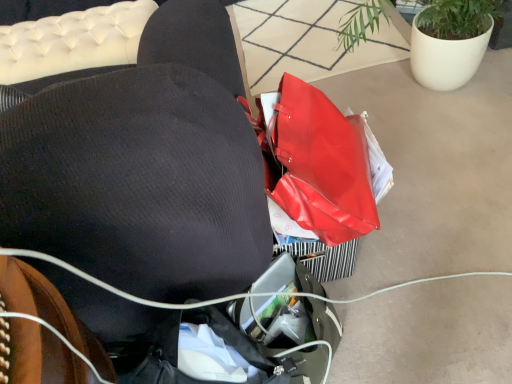
Question: Considering the positions of black fabric bean bag chair at center and matte white pot at upper right in the image, is black fabric bean bag chair at center wider or thinner than matte white pot at upper right?

Choices:
 (A) wide
 (B) thin

Answer: (A)

Question: From a real-world perspective, is black fabric bean bag chair at center above or below matte white pot at upper right?

Choices:
 (A) above
 (B) below

Answer: (A)

Question: In terms of size, does black fabric bean bag chair at center appear bigger or smaller than matte white pot at upper right?

Choices:
 (A) big
 (B) small

Answer: (A)

Question: Relative to black fabric bean bag chair at center, is matte white pot at upper right in front or behind?

Choices:
 (A) behind
 (B) front

Answer: (A)

Question: Is point (345, 31) closer or farther from the camera than point (42, 201)?

Choices:
 (A) farther
 (B) closer

Answer: (A)

Question: In terms of size, does matte white pot at upper right appear bigger or smaller than black fabric bean bag chair at center?

Choices:
 (A) big
 (B) small

Answer: (B)

Question: In the image, is matte white pot at upper right on the left side or the right side of black fabric bean bag chair at center?

Choices:
 (A) right
 (B) left

Answer: (A)